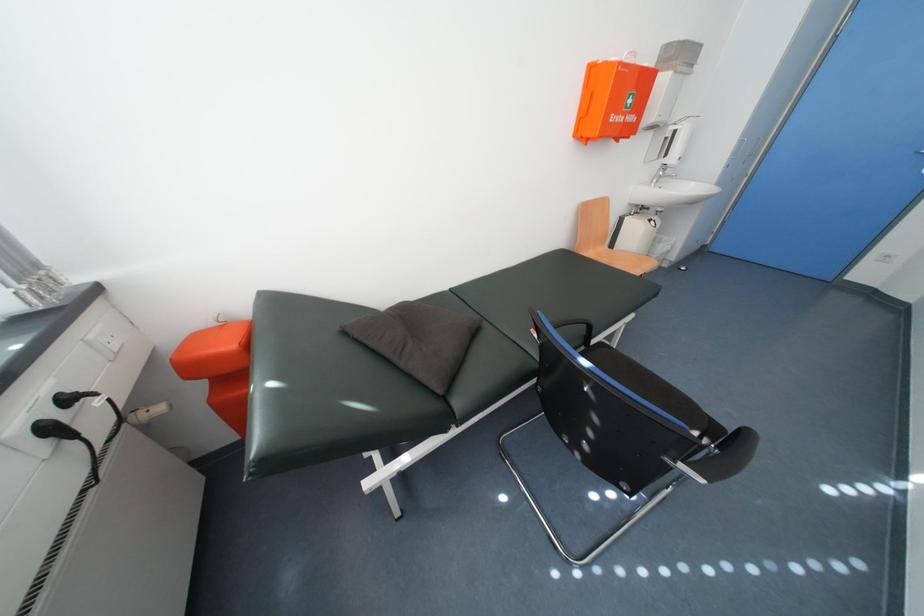
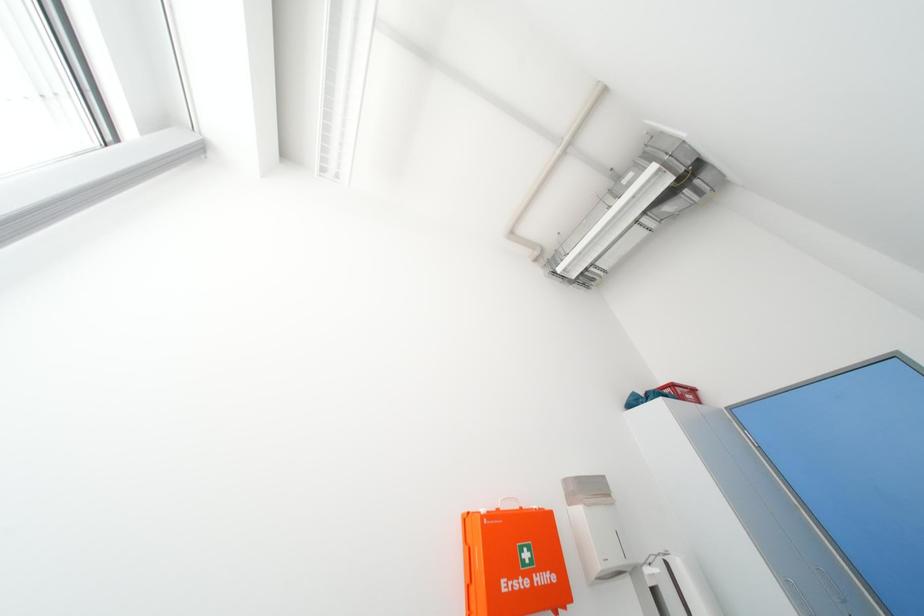
The images are taken continuously from a first-person perspective. In which direction is your viewpoint rotating?

The camera rotated toward left-up.